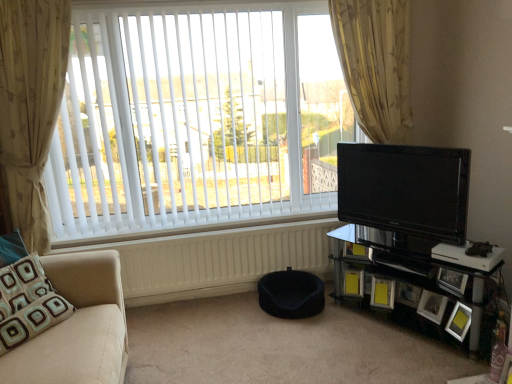
This screenshot has height=384, width=512. Identify the location of free space between yellow matte picture frame at lower right, positioned as the 6th picture frame in left-to-right order, and black fabric bean bag at center. [367, 325].